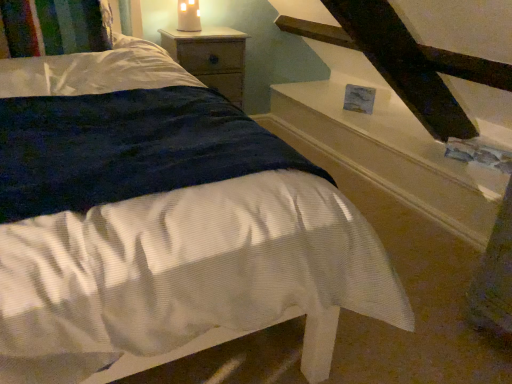
Where is `free space that is to the left of matte white candle at upper center`? Image resolution: width=512 pixels, height=384 pixels. free space that is to the left of matte white candle at upper center is located at coordinates (168, 33).